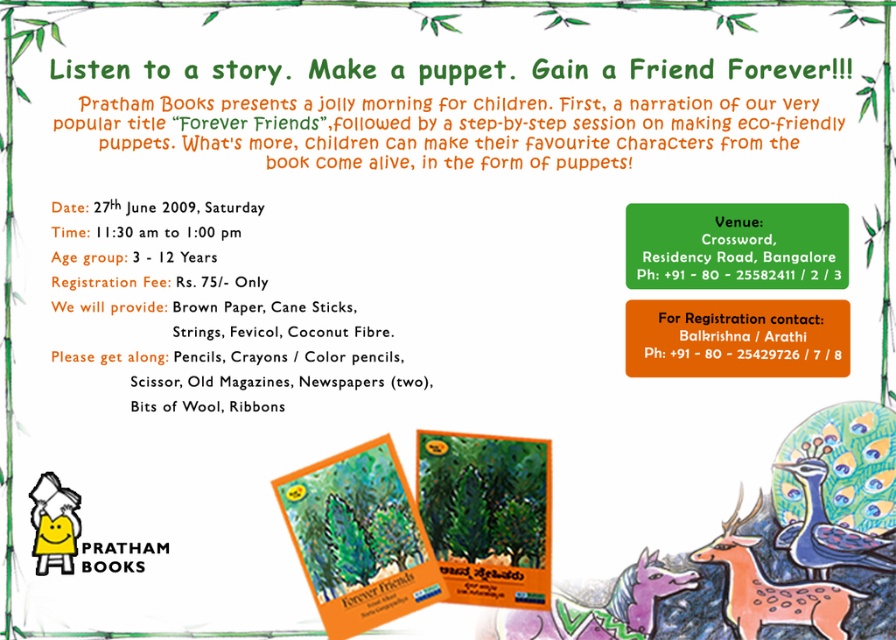
Question: Is brown paper at upper left below matte orange book at lower left?

Choices:
 (A) no
 (B) yes

Answer: (A)

Question: Which point is farther to the camera?

Choices:
 (A) brown paper at upper left
 (B) blue glossy peacock at center

Answer: (B)

Question: Which object appears closest to the camera in this image?

Choices:
 (A) blue glossy peacock at center
 (B) purple felt unicorn at lower center

Answer: (A)

Question: Where is matte orange deer at center located in relation to blue glossy peacock at center in the image?

Choices:
 (A) above
 (B) below

Answer: (B)

Question: Which of the following is the farthest from the observer?

Choices:
 (A) orange text at upper center
 (B) matte orange deer at center
 (C) brown paper at upper left
 (D) blue glossy peacock at center

Answer: (B)

Question: Does brown paper at upper left appear under matte orange book at lower left?

Choices:
 (A) no
 (B) yes

Answer: (A)